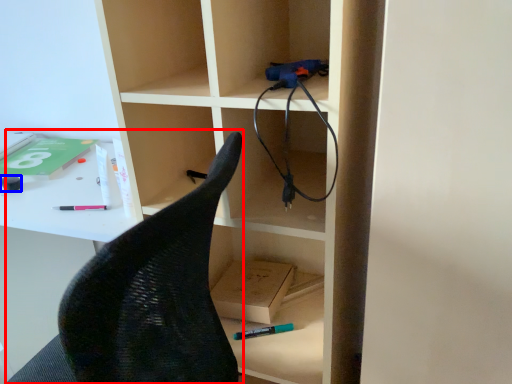
Question: Which object is further to the camera taking this photo, armchair (highlighted by a red box) or stationery (highlighted by a blue box)?

Choices:
 (A) armchair
 (B) stationery

Answer: (B)